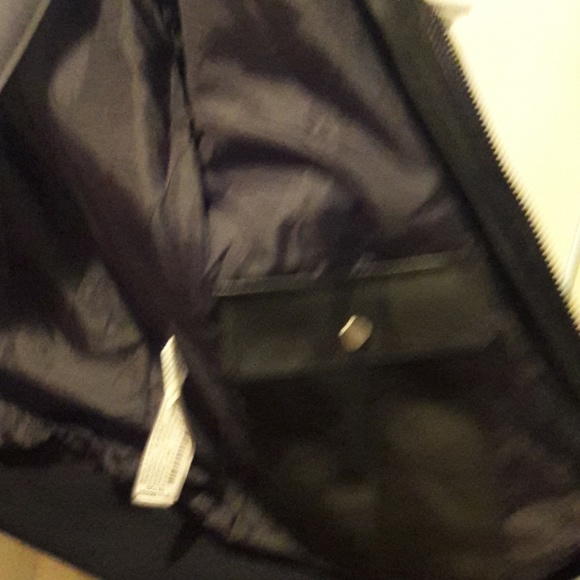
In order to click on table in this screenshot , I will do `click(29, 574)`.